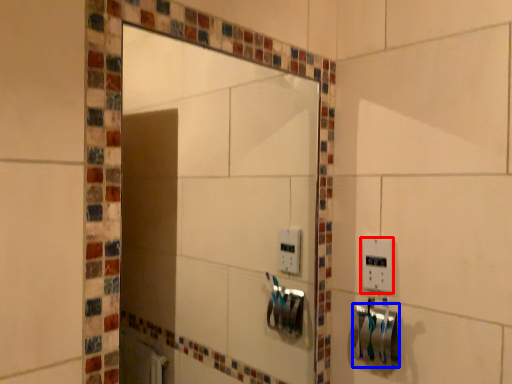
Question: Among these objects, which one is nearest to the camera, light switch (highlighted by a red box) or towel bar (highlighted by a blue box)?

Choices:
 (A) light switch
 (B) towel bar

Answer: (B)